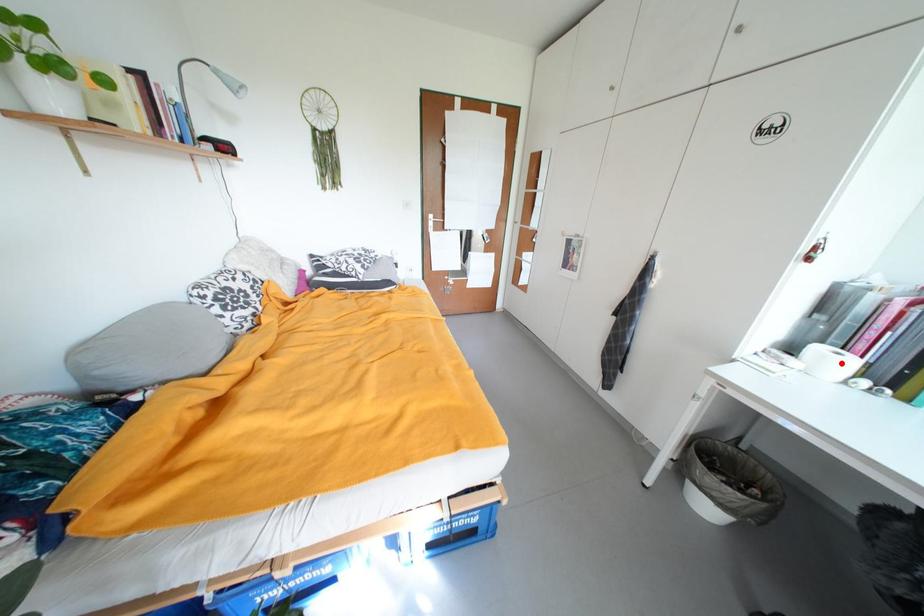
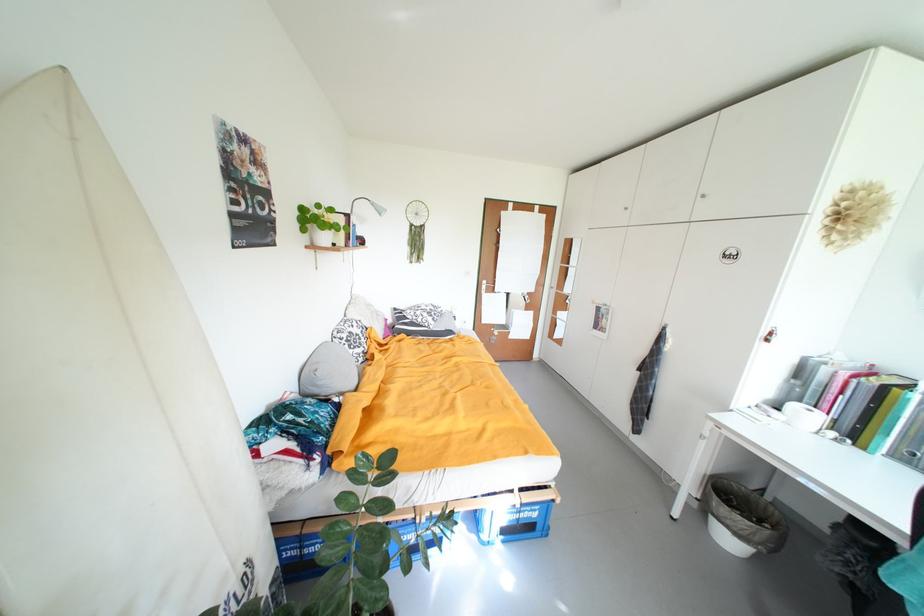
Find the pixel in the second image that matches the highlighted location in the first image.

(817, 419)